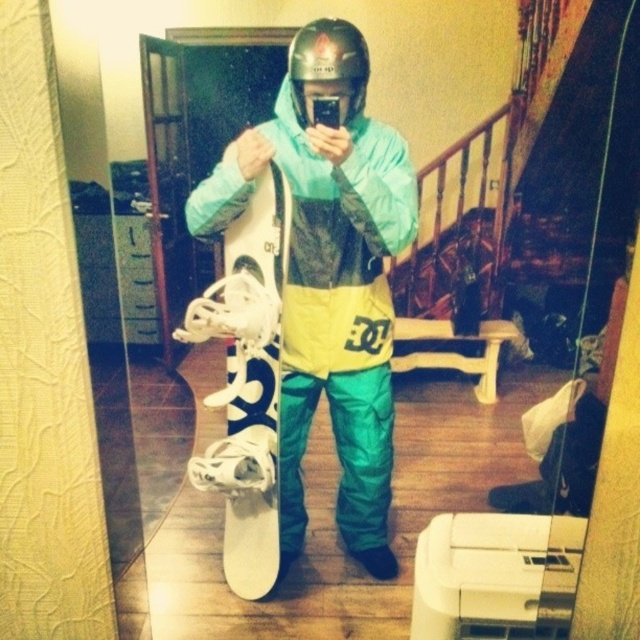
Question: Is matte white snowboard at center bigger than white matte snowboard at center?

Choices:
 (A) yes
 (B) no

Answer: (A)

Question: Which object is closer to the camera taking this photo?

Choices:
 (A) white matte snowboard at center
 (B) matte white snowboard at center

Answer: (B)

Question: Which object appears farthest from the camera in this image?

Choices:
 (A) white matte snowboard at center
 (B) matte white snowboard at center

Answer: (A)

Question: Which object is closer to the camera taking this photo?

Choices:
 (A) matte white snowboard at center
 (B) white matte snowboard at center
 (C) matte black helmet at center

Answer: (A)

Question: Can you confirm if matte white snowboard at center is positioned below matte black helmet at center?

Choices:
 (A) no
 (B) yes

Answer: (B)

Question: Can you confirm if matte white snowboard at center is thinner than matte black helmet at center?

Choices:
 (A) yes
 (B) no

Answer: (B)